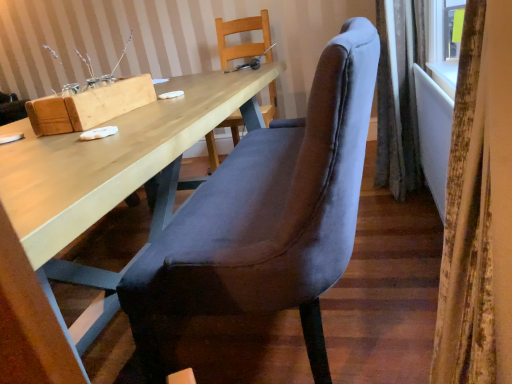
Question: Is matte wood desk at center not within wooden chair at upper center, marked as the first chair in a back-to-front arrangement?

Choices:
 (A) no
 (B) yes

Answer: (B)

Question: Can you confirm if matte wood desk at center is wider than wooden chair at upper center, marked as the first chair in a back-to-front arrangement?

Choices:
 (A) yes
 (B) no

Answer: (A)

Question: Is matte wood desk at center to the left of wooden chair at upper center, acting as the 2th chair starting from the front, from the viewer's perspective?

Choices:
 (A) no
 (B) yes

Answer: (B)

Question: From the image's perspective, does matte wood desk at center appear lower than wooden chair at upper center, marked as the first chair in a back-to-front arrangement?

Choices:
 (A) yes
 (B) no

Answer: (A)

Question: From the image's perspective, is matte wood desk at center on top of wooden chair at upper center, marked as the first chair in a back-to-front arrangement?

Choices:
 (A) no
 (B) yes

Answer: (A)

Question: Would you say velvet grey chair at center, positioned as the 1th chair in front-to-back order, is inside or outside velvet curtain at right, placed as the second curtain when sorted from right to left?

Choices:
 (A) inside
 (B) outside

Answer: (B)

Question: From the image's perspective, is velvet grey chair at center, positioned as the 1th chair in front-to-back order, above or below velvet curtain at right, the 1th curtain when ordered from front to back?

Choices:
 (A) above
 (B) below

Answer: (A)

Question: Looking at their shapes, would you say velvet grey chair at center, positioned as the 1th chair in front-to-back order, is wider or thinner than velvet curtain at right, the 1th curtain when ordered from front to back?

Choices:
 (A) thin
 (B) wide

Answer: (B)

Question: From a real-world perspective, relative to velvet curtain at right, the 1th curtain when ordered from front to back, is velvet grey chair at center, positioned as the 1th chair in front-to-back order, vertically above or below?

Choices:
 (A) below
 (B) above

Answer: (B)

Question: Considering the positions of velvet gray curtain at right, positioned as the second curtain in front-to-back order, and matte wood desk at center in the image, is velvet gray curtain at right, positioned as the second curtain in front-to-back order, wider or thinner than matte wood desk at center?

Choices:
 (A) wide
 (B) thin

Answer: (B)

Question: Is point (380, 140) positioned closer to the camera than point (58, 339)?

Choices:
 (A) farther
 (B) closer

Answer: (A)

Question: Considering the positions of velvet gray curtain at right, which appears as the 1th curtain when viewed from the right, and matte wood desk at center in the image, is velvet gray curtain at right, which appears as the 1th curtain when viewed from the right, taller or shorter than matte wood desk at center?

Choices:
 (A) short
 (B) tall

Answer: (B)

Question: From the image's perspective, is velvet gray curtain at right, placed as the 1th curtain when sorted from back to front, located above or below matte wood desk at center?

Choices:
 (A) below
 (B) above

Answer: (B)

Question: Based on their positions, is matte wood desk at center located to the left or right of velvet gray curtain at right, placed as the 1th curtain when sorted from back to front?

Choices:
 (A) right
 (B) left

Answer: (B)

Question: Is point (234, 104) positioned closer to the camera than point (396, 190)?

Choices:
 (A) closer
 (B) farther

Answer: (A)